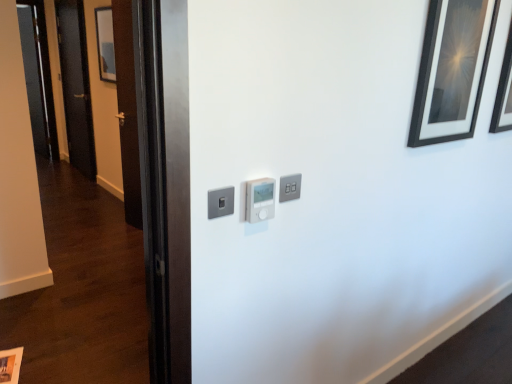
Question: Considering the positions of point (286, 178) and point (502, 127), is point (286, 178) closer or farther from the camera than point (502, 127)?

Choices:
 (A) farther
 (B) closer

Answer: (B)

Question: From the image's perspective, is satin silver light switch at upper center, the first light switch positioned from the right, located above or below black glossy picture frame at upper right, acting as the third picture frame starting from the bottom?

Choices:
 (A) below
 (B) above

Answer: (A)

Question: Which object is positioned farthest from the matte white picture frame at lower left, the 3th picture frame in the front-to-back sequence?

Choices:
 (A) satin silver light switch at upper center, the first light switch positioned from the right
 (B) black matte picture frame at upper right, placed as the third picture frame when sorted from top to bottom
 (C) white plastic thermostat at center, placed as the second light switch when sorted from right to left
 (D) black glossy picture frame at upper right, the fourth picture frame from the left
 (E) black matte door at left

Answer: (E)

Question: Based on their relative distances, which object is farther from the black matte picture frame at upper right, placed as the third picture frame when sorted from top to bottom?

Choices:
 (A) matte black picture frame at upper left, which is the 1th picture frame in top-to-bottom order
 (B) satin silver light switch at upper center, which is the third light switch in left-to-right order
 (C) white plastic thermostat at center, the 2th light switch from the left
 (D) satin silver switch at center, which is the 1th light switch in left-to-right order
 (E) black matte door at left

Answer: (E)